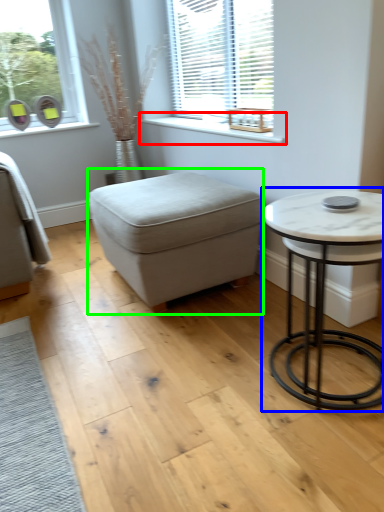
Question: Considering the real-world distances, which object is farthest from window sill (highlighted by a red box)? table (highlighted by a blue box) or music stool (highlighted by a green box)?

Choices:
 (A) table
 (B) music stool

Answer: (A)